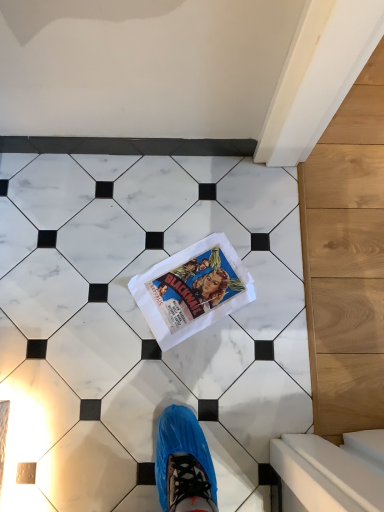
Find the location of `vacant region to the right of white paper comic book at center`. vacant region to the right of white paper comic book at center is located at coordinates (280, 292).